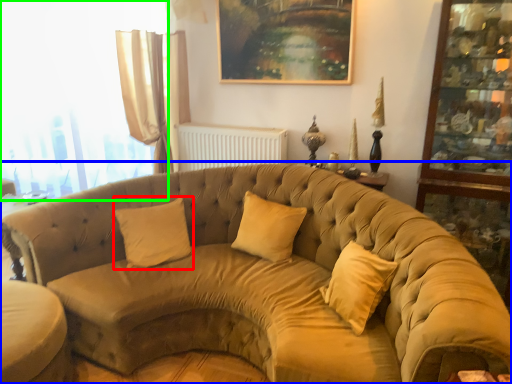
Question: Based on their relative distances, which object is nearer to pillow (highlighted by a red box)? Choose from studio couch (highlighted by a blue box) and window (highlighted by a green box).

Choices:
 (A) studio couch
 (B) window

Answer: (A)